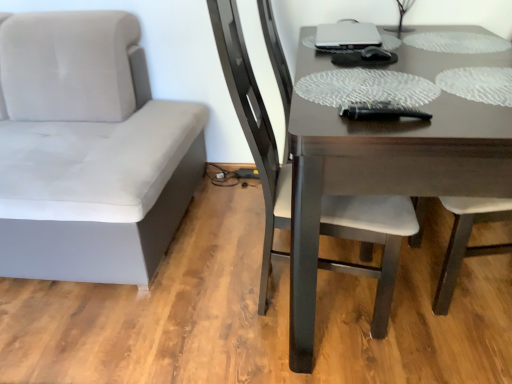
Measure the distance between point (54, 27) and camera.

1.83 meters.

What do you see at coordinates (347, 35) in the screenshot? This screenshot has height=384, width=512. I see `satin silver laptop at upper center` at bounding box center [347, 35].

You are a GUI agent. You are given a task and a screenshot of the screen. Output one action in this format:
    pyautogui.click(x=<x>, y=<y>)
    Task: Click on the dark brown wooden table at center
    The width and height of the screenshot is (512, 384).
    Given the screenshot: What is the action you would take?
    pyautogui.click(x=383, y=177)

Image resolution: width=512 pixels, height=384 pixels. Describe the element at coordinates (254, 130) in the screenshot. I see `dark brown wood chair at center, arranged as the second chair when viewed from the left` at that location.

Find the location of a particular element. This screenshot has height=384, width=512. suede gray chair at left, positioned as the 1th chair in left-to-right order is located at coordinates (89, 150).

Is dark brown wood chair at center, arranged as the second chair when viewed from the left, to the left of satin silver laptop at upper center from the viewer's perspective?

Correct, you'll find dark brown wood chair at center, arranged as the second chair when viewed from the left, to the left of satin silver laptop at upper center.

From the image's perspective, would you say dark brown wood chair at center, acting as the 1th chair starting from the right, is positioned over satin silver laptop at upper center?

Incorrect, from the image's perspective, dark brown wood chair at center, acting as the 1th chair starting from the right, is lower than satin silver laptop at upper center.

Between dark brown wood chair at center, arranged as the second chair when viewed from the left, and satin silver laptop at upper center, which one has smaller width?

satin silver laptop at upper center is thinner.

Is suede gray chair at left, positioned as the 1th chair in left-to-right order, not inside dark brown wooden table at center?

suede gray chair at left, positioned as the 1th chair in left-to-right order, is positioned outside dark brown wooden table at center.

Are suede gray chair at left, positioned as the 1th chair in left-to-right order, and dark brown wooden table at center located far from each other?

Actually, suede gray chair at left, positioned as the 1th chair in left-to-right order, and dark brown wooden table at center are a little close together.

From the picture: Visually, is suede gray chair at left, positioned as the 1th chair in left-to-right order, positioned to the left or to the right of dark brown wooden table at center?

suede gray chair at left, positioned as the 1th chair in left-to-right order, is to the left of dark brown wooden table at center.

Considering the relative sizes of dark brown wooden table at center and suede gray chair at left, placed as the 2th chair when sorted from right to left, in the image provided, is dark brown wooden table at center wider than suede gray chair at left, placed as the 2th chair when sorted from right to left,?

No, dark brown wooden table at center is not wider than suede gray chair at left, placed as the 2th chair when sorted from right to left.

Is dark brown wooden table at center placed right next to suede gray chair at left, positioned as the 1th chair in left-to-right order?

dark brown wooden table at center is not next to suede gray chair at left, positioned as the 1th chair in left-to-right order, and they're not touching.

Which point is more forward, (456,109) or (27,168)?

The point (456,109) is closer to the camera.

I want to click on table below the suede gray chair at left, positioned as the 1th chair in left-to-right order (from a real-world perspective), so click(x=383, y=177).

Does satin silver laptop at upper center appear on the right side of dark brown wood chair at center, acting as the 1th chair starting from the right?

Indeed, satin silver laptop at upper center is positioned on the right side of dark brown wood chair at center, acting as the 1th chair starting from the right.

How far apart are satin silver laptop at upper center and dark brown wood chair at center, acting as the 1th chair starting from the right?

A distance of 24.66 inches exists between satin silver laptop at upper center and dark brown wood chair at center, acting as the 1th chair starting from the right.

From a real-world perspective, which is physically below, satin silver laptop at upper center or dark brown wood chair at center, acting as the 1th chair starting from the right?

dark brown wood chair at center, acting as the 1th chair starting from the right, from a real-world perspective.

Considering the sizes of satin silver laptop at upper center and dark brown wood chair at center, acting as the 1th chair starting from the right, in the image, is satin silver laptop at upper center taller or shorter than dark brown wood chair at center, acting as the 1th chair starting from the right,?

satin silver laptop at upper center is shorter than dark brown wood chair at center, acting as the 1th chair starting from the right.

Considering the sizes of suede gray chair at left, positioned as the 1th chair in left-to-right order, and dark brown wood chair at center, acting as the 1th chair starting from the right, in the image, is suede gray chair at left, positioned as the 1th chair in left-to-right order, taller or shorter than dark brown wood chair at center, acting as the 1th chair starting from the right,?

In the image, suede gray chair at left, positioned as the 1th chair in left-to-right order, appears to be shorter than dark brown wood chair at center, acting as the 1th chair starting from the right.

This screenshot has width=512, height=384. I want to click on chair to the left of dark brown wood chair at center, acting as the 1th chair starting from the right, so click(89, 150).

Is suede gray chair at left, placed as the 2th chair when sorted from right to left, wider than dark brown wood chair at center, acting as the 1th chair starting from the right?

Yes, suede gray chair at left, placed as the 2th chair when sorted from right to left, is wider than dark brown wood chair at center, acting as the 1th chair starting from the right.

Looking at their sizes, would you say dark brown wood chair at center, acting as the 1th chair starting from the right, is wider or thinner than suede gray chair at left, placed as the 2th chair when sorted from right to left?

Considering their sizes, dark brown wood chair at center, acting as the 1th chair starting from the right, looks slimmer than suede gray chair at left, placed as the 2th chair when sorted from right to left.

Locate an element on the screen. chair below the suede gray chair at left, placed as the 2th chair when sorted from right to left (from the image's perspective) is located at coordinates (254, 130).

Based on the photo, is dark brown wood chair at center, arranged as the second chair when viewed from the left, with suede gray chair at left, placed as the 2th chair when sorted from right to left?

No, dark brown wood chair at center, arranged as the second chair when viewed from the left, is not making contact with suede gray chair at left, placed as the 2th chair when sorted from right to left.

Considering the relative sizes of dark brown wood chair at center, arranged as the second chair when viewed from the left, and suede gray chair at left, placed as the 2th chair when sorted from right to left, in the image provided, is dark brown wood chair at center, arranged as the second chair when viewed from the left, bigger than suede gray chair at left, placed as the 2th chair when sorted from right to left,?

Actually, dark brown wood chair at center, arranged as the second chair when viewed from the left, might be smaller than suede gray chair at left, placed as the 2th chair when sorted from right to left.

At what (x,y) coordinates should I click in order to perform the action: click on laptop behind the suede gray chair at left, positioned as the 1th chair in left-to-right order. Please return your answer as a coordinate pair (x, y). The height and width of the screenshot is (384, 512). Looking at the image, I should click on point(347,35).

From a real-world perspective, who is located higher, satin silver laptop at upper center or suede gray chair at left, positioned as the 1th chair in left-to-right order?

satin silver laptop at upper center.

How many degrees apart are the facing directions of satin silver laptop at upper center and suede gray chair at left, positioned as the 1th chair in left-to-right order?

There is a 91.5-degree angle between the facing directions of satin silver laptop at upper center and suede gray chair at left, positioned as the 1th chair in left-to-right order.

From the satin silver laptop at upper center, count the 1st chair to the left and point to it. Please provide its 2D coordinates.

[(254, 130)]

Where is `table in front of the suede gray chair at left, placed as the 2th chair when sorted from right to left`? This screenshot has width=512, height=384. table in front of the suede gray chair at left, placed as the 2th chair when sorted from right to left is located at coordinates (383, 177).

Considering their positions, is suede gray chair at left, positioned as the 1th chair in left-to-right order, positioned further to dark brown wooden table at center than dark brown wood chair at center, acting as the 1th chair starting from the right?

Based on the image, suede gray chair at left, positioned as the 1th chair in left-to-right order, appears to be further to dark brown wooden table at center.

Looking at the image, which one is located further to dark brown wood chair at center, arranged as the second chair when viewed from the left, suede gray chair at left, positioned as the 1th chair in left-to-right order, or dark brown wooden table at center?

suede gray chair at left, positioned as the 1th chair in left-to-right order, lies further to dark brown wood chair at center, arranged as the second chair when viewed from the left, than the other object.

Considering their positions, is dark brown wooden table at center positioned further to satin silver laptop at upper center than suede gray chair at left, placed as the 2th chair when sorted from right to left?

Among the two, suede gray chair at left, placed as the 2th chair when sorted from right to left, is located further to satin silver laptop at upper center.

Based on their spatial positions, is satin silver laptop at upper center or dark brown wooden table at center further from dark brown wood chair at center, acting as the 1th chair starting from the right?

satin silver laptop at upper center is positioned further to the anchor dark brown wood chair at center, acting as the 1th chair starting from the right.

Considering their positions, is dark brown wooden table at center positioned closer to satin silver laptop at upper center than dark brown wood chair at center, acting as the 1th chair starting from the right?

Based on the image, dark brown wooden table at center appears to be nearer to satin silver laptop at upper center.

Estimate the real-world distances between objects in this image. Which object is closer to dark brown wood chair at center, acting as the 1th chair starting from the right, dark brown wooden table at center or satin silver laptop at upper center?

Based on the image, dark brown wooden table at center appears to be nearer to dark brown wood chair at center, acting as the 1th chair starting from the right.

From the picture: Which object lies further to the anchor point suede gray chair at left, placed as the 2th chair when sorted from right to left, dark brown wood chair at center, acting as the 1th chair starting from the right, or satin silver laptop at upper center?

satin silver laptop at upper center lies further to suede gray chair at left, placed as the 2th chair when sorted from right to left, than the other object.

Based on their spatial positions, is satin silver laptop at upper center or dark brown wood chair at center, arranged as the second chair when viewed from the left, closer to dark brown wooden table at center?

The object closer to dark brown wooden table at center is dark brown wood chair at center, arranged as the second chair when viewed from the left.

This screenshot has width=512, height=384. Identify the location of chair between suede gray chair at left, placed as the 2th chair when sorted from right to left, and dark brown wooden table at center. (254, 130).

This screenshot has width=512, height=384. I want to click on chair between suede gray chair at left, placed as the 2th chair when sorted from right to left, and satin silver laptop at upper center, in the horizontal direction, so click(x=254, y=130).

I want to click on laptop between suede gray chair at left, positioned as the 1th chair in left-to-right order, and dark brown wooden table at center from left to right, so click(x=347, y=35).